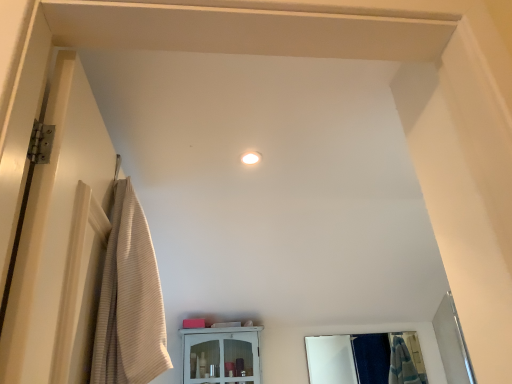
Question: Looking at the image, does clear glass mirror at center seem bigger or smaller compared to white glossy cabinet at center?

Choices:
 (A) small
 (B) big

Answer: (A)

Question: From a real-world perspective, is clear glass mirror at center positioned above or below white glossy cabinet at center?

Choices:
 (A) above
 (B) below

Answer: (B)

Question: Estimate the real-world distances between objects in this image. Which object is farther from the beige ribbed towel at left?

Choices:
 (A) clear glass mirror at center
 (B) white glossy cabinet at center

Answer: (A)

Question: Which of these objects is positioned farthest from the clear glass mirror at center?

Choices:
 (A) beige ribbed towel at left
 (B) white glossy cabinet at center

Answer: (A)